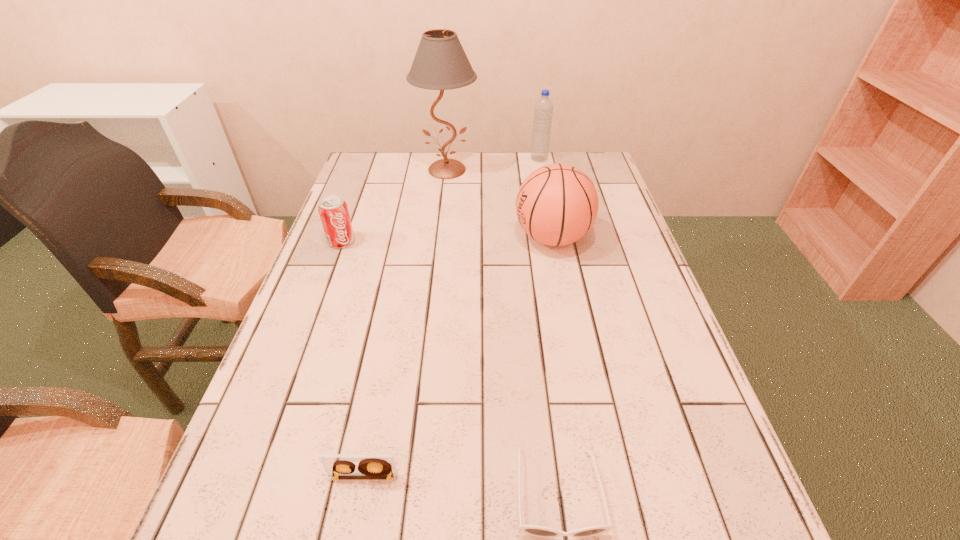
This screenshot has width=960, height=540. Identify the location of vacant point that satisfies the following two spatial constraints: 1. on the front side of the water bottle; 2. on the surface of the basketball near the brand logo. (555, 238).